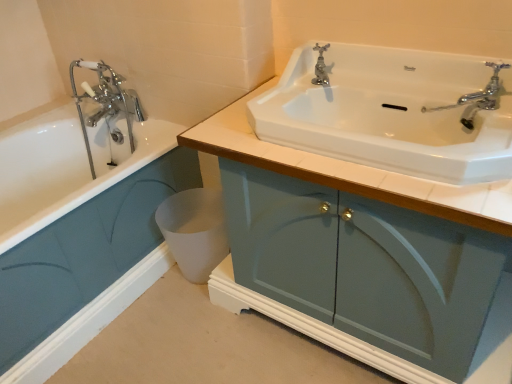
This screenshot has height=384, width=512. Find the location of `white glossy sink at upper center`. white glossy sink at upper center is located at coordinates (390, 112).

From a real-world perspective, is matte blue cabinet at center, the 2th bathroom cabinet viewed from the left, physically below matte teal cabinet at lower left, the 1th bathroom cabinet positioned from the left?

No.

Which is in front, point (249, 162) or point (95, 333)?

The point (249, 162) is closer to the camera.

From the image's perspective, between matte blue cabinet at center, positioned as the 1th bathroom cabinet in right-to-left order, and matte teal cabinet at lower left, the 1th bathroom cabinet positioned from the left, which one is located above?

matte teal cabinet at lower left, the 1th bathroom cabinet positioned from the left.

Would you say matte blue cabinet at center, the 2th bathroom cabinet viewed from the left, is inside or outside matte teal cabinet at lower left, the 1th bathroom cabinet positioned from the left?

matte blue cabinet at center, the 2th bathroom cabinet viewed from the left, is outside matte teal cabinet at lower left, the 1th bathroom cabinet positioned from the left.

What's the angular difference between polished chrome faucet at upper center and matte blue cabinet at center, positioned as the 1th bathroom cabinet in right-to-left order,'s facing directions?

90.5 degrees separate the facing orientations of polished chrome faucet at upper center and matte blue cabinet at center, positioned as the 1th bathroom cabinet in right-to-left order.

From the image's perspective, is polished chrome faucet at upper center beneath matte blue cabinet at center, the 2th bathroom cabinet viewed from the left?

No, from the image's perspective, polished chrome faucet at upper center is not beneath matte blue cabinet at center, the 2th bathroom cabinet viewed from the left.

I want to click on the 2nd bathroom cabinet in front of the polished chrome faucet at upper center, counting from the anchor's position, so click(351, 172).

From a real-world perspective, does polished chrome faucet at upper center sit lower than matte blue cabinet at center, positioned as the 1th bathroom cabinet in right-to-left order?

No, from a real-world perspective, polished chrome faucet at upper center is not beneath matte blue cabinet at center, positioned as the 1th bathroom cabinet in right-to-left order.

Considering the sizes of objects matte teal cabinet at lower left, the 1th bathroom cabinet positioned from the left, and matte blue cabinet at center, the 2th bathroom cabinet viewed from the left, in the image provided, who is taller, matte teal cabinet at lower left, the 1th bathroom cabinet positioned from the left, or matte blue cabinet at center, the 2th bathroom cabinet viewed from the left,?

Standing taller between the two is matte blue cabinet at center, the 2th bathroom cabinet viewed from the left.

I want to click on bathroom cabinet that appears below the matte blue cabinet at center, the 2th bathroom cabinet viewed from the left (from a real-world perspective), so click(x=82, y=225).

Looking at this image, is matte teal cabinet at lower left, the 2th bathroom cabinet positioned from the right, not near matte blue cabinet at center, the 2th bathroom cabinet viewed from the left?

That's not correct — matte teal cabinet at lower left, the 2th bathroom cabinet positioned from the right, is a little close to matte blue cabinet at center, the 2th bathroom cabinet viewed from the left.

Is the depth of matte teal cabinet at lower left, the 1th bathroom cabinet positioned from the left, less than that of matte blue cabinet at center, positioned as the 1th bathroom cabinet in right-to-left order?

No.

Looking at this image, would you say polished chrome faucet at upper center is a long distance from matte teal cabinet at lower left, the 1th bathroom cabinet positioned from the left?

No, polished chrome faucet at upper center is in close proximity to matte teal cabinet at lower left, the 1th bathroom cabinet positioned from the left.

I want to click on tap behind the matte teal cabinet at lower left, the 1th bathroom cabinet positioned from the left, so click(x=320, y=67).

Can you confirm if polished chrome faucet at upper center is thinner than matte teal cabinet at lower left, the 2th bathroom cabinet positioned from the right?

Yes, polished chrome faucet at upper center is thinner than matte teal cabinet at lower left, the 2th bathroom cabinet positioned from the right.

Considering the sizes of polished chrome faucet at upper center and matte teal cabinet at lower left, the 1th bathroom cabinet positioned from the left, in the image, is polished chrome faucet at upper center taller or shorter than matte teal cabinet at lower left, the 1th bathroom cabinet positioned from the left,?

Clearly, polished chrome faucet at upper center is shorter compared to matte teal cabinet at lower left, the 1th bathroom cabinet positioned from the left.

Considering the points (309, 86) and (317, 45), which point is in front, point (309, 86) or point (317, 45)?

The point (309, 86) is closer.

Measure the distance between white glossy sink at upper center and polished chrome faucet at upper center.

11.59 inches.

From the image's perspective, which is above, white glossy sink at upper center or polished chrome faucet at upper center?

polished chrome faucet at upper center is shown above in the image.

Which of these two, white glossy sink at upper center or polished chrome faucet at upper center, is thinner?

polished chrome faucet at upper center is thinner.

Is white glossy sink at upper center facing towards white matte toilet bowl at lower center?

No, white glossy sink at upper center is not turned towards white matte toilet bowl at lower center.

Looking at this image, is white glossy sink at upper center positioned far away from white matte toilet bowl at lower center?

They are positioned close to each other.

From the image's perspective, relative to white matte toilet bowl at lower center, is white glossy sink at upper center above or below?

From the image's perspective, white glossy sink at upper center appears above white matte toilet bowl at lower center.

Which object is positioned more to the left, white glossy sink at upper center or white matte toilet bowl at lower center?

white matte toilet bowl at lower center.

Consider the image. Is white glossy sink at upper center in front of or behind matte teal cabinet at lower left, the 1th bathroom cabinet positioned from the left, in the image?

Visually, white glossy sink at upper center is located in front of matte teal cabinet at lower left, the 1th bathroom cabinet positioned from the left.

Is white glossy sink at upper center looking in the opposite direction of matte teal cabinet at lower left, the 1th bathroom cabinet positioned from the left?

white glossy sink at upper center does not have its back to matte teal cabinet at lower left, the 1th bathroom cabinet positioned from the left.

From the image's perspective, is white glossy sink at upper center beneath matte teal cabinet at lower left, the 2th bathroom cabinet positioned from the right?

No, from the image's perspective, white glossy sink at upper center is not below matte teal cabinet at lower left, the 2th bathroom cabinet positioned from the right.

Is white glossy sink at upper center not near matte teal cabinet at lower left, the 2th bathroom cabinet positioned from the right?

No, white glossy sink at upper center is in close proximity to matte teal cabinet at lower left, the 2th bathroom cabinet positioned from the right.

Locate an element on the screen. bathroom cabinet that appears above the matte teal cabinet at lower left, the 2th bathroom cabinet positioned from the right (from a real-world perspective) is located at coordinates (351, 172).

From a real-world perspective, which bathroom cabinet is the 1st one underneath the polished chrome faucet at upper center? Please provide its 2D coordinates.

[(351, 172)]

When comparing their distances from white matte toilet bowl at lower center, does white glossy sink at upper center or matte teal cabinet at lower left, the 1th bathroom cabinet positioned from the left, seem closer?

matte teal cabinet at lower left, the 1th bathroom cabinet positioned from the left, lies closer to white matte toilet bowl at lower center than the other object.

Which object lies nearer to the anchor point white matte toilet bowl at lower center, polished chrome faucet at upper center or matte blue cabinet at center, positioned as the 1th bathroom cabinet in right-to-left order?

matte blue cabinet at center, positioned as the 1th bathroom cabinet in right-to-left order, is positioned closer to the anchor white matte toilet bowl at lower center.

Estimate the real-world distances between objects in this image. Which object is further from matte blue cabinet at center, positioned as the 1th bathroom cabinet in right-to-left order, matte teal cabinet at lower left, the 1th bathroom cabinet positioned from the left, or polished chrome faucet at upper center?

matte teal cabinet at lower left, the 1th bathroom cabinet positioned from the left, is further to matte blue cabinet at center, positioned as the 1th bathroom cabinet in right-to-left order.

Estimate the real-world distances between objects in this image. Which object is closer to matte blue cabinet at center, positioned as the 1th bathroom cabinet in right-to-left order, white glossy sink at upper center or matte teal cabinet at lower left, the 2th bathroom cabinet positioned from the right?

white glossy sink at upper center.

From the image, which object appears to be nearer to matte blue cabinet at center, positioned as the 1th bathroom cabinet in right-to-left order, white matte toilet bowl at lower center or polished chrome faucet at upper center?

polished chrome faucet at upper center.

Looking at this image, based on their spatial positions, is polished chrome faucet at upper center or white glossy sink at upper center closer to matte blue cabinet at center, the 2th bathroom cabinet viewed from the left?

white glossy sink at upper center.

Considering their positions, is polished chrome faucet at upper center positioned further to white glossy sink at upper center than matte blue cabinet at center, positioned as the 1th bathroom cabinet in right-to-left order?

Based on the image, polished chrome faucet at upper center appears to be further to white glossy sink at upper center.

Which object lies nearer to the anchor point polished chrome faucet at upper center, matte blue cabinet at center, the 2th bathroom cabinet viewed from the left, or matte teal cabinet at lower left, the 1th bathroom cabinet positioned from the left?

matte blue cabinet at center, the 2th bathroom cabinet viewed from the left, lies closer to polished chrome faucet at upper center than the other object.

The image size is (512, 384). Identify the location of toilet bowl between matte teal cabinet at lower left, the 2th bathroom cabinet positioned from the right, and matte blue cabinet at center, the 2th bathroom cabinet viewed from the left. (194, 231).

You are a GUI agent. You are given a task and a screenshot of the screen. Output one action in this format:
    pyautogui.click(x=<x>, y=<y>)
    Task: Click on the tap located between matte blue cabinet at center, positioned as the 1th bathroom cabinet in right-to-left order, and white matte toilet bowl at lower center in the depth direction
    The image size is (512, 384).
    Given the screenshot: What is the action you would take?
    pyautogui.click(x=320, y=67)

Where is `sink between matte blue cabinet at center, positioned as the 1th bathroom cabinet in right-to-left order, and white matte toilet bowl at lower center from front to back`? The width and height of the screenshot is (512, 384). sink between matte blue cabinet at center, positioned as the 1th bathroom cabinet in right-to-left order, and white matte toilet bowl at lower center from front to back is located at coordinates (390, 112).

I want to click on sink between matte blue cabinet at center, positioned as the 1th bathroom cabinet in right-to-left order, and polished chrome faucet at upper center in the front-back direction, so click(390, 112).